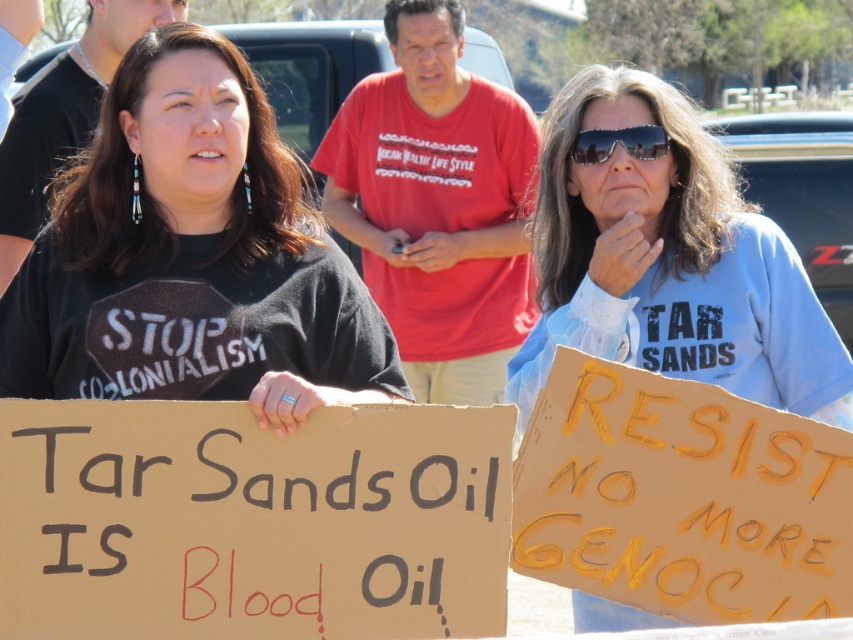
Does brown cardboard sign at center appear on the left side of yellow cardboard sign at center?

Indeed, brown cardboard sign at center is positioned on the left side of yellow cardboard sign at center.

Does brown cardboard sign at center appear over yellow cardboard sign at center?

Yes, brown cardboard sign at center is above yellow cardboard sign at center.

This screenshot has width=853, height=640. Identify the location of brown cardboard sign at center. (251, 522).

Image resolution: width=853 pixels, height=640 pixels. In order to click on blue cotton shirt at center in this screenshot , I will do point(669,262).

Is blue cotton shirt at center thinner than yellow cardboard sign at center?

In fact, blue cotton shirt at center might be wider than yellow cardboard sign at center.

At what (x,y) coordinates should I click in order to perform the action: click on blue cotton shirt at center. Please return your answer as a coordinate pair (x, y). The width and height of the screenshot is (853, 640). Looking at the image, I should click on (669, 262).

Is blue cotton shirt at center to the left of sunglasses at center from the viewer's perspective?

Correct, you'll find blue cotton shirt at center to the left of sunglasses at center.

Describe the element at coordinates (669, 262) in the screenshot. I see `blue cotton shirt at center` at that location.

The image size is (853, 640). What are the coordinates of `blue cotton shirt at center` in the screenshot? It's located at (669, 262).